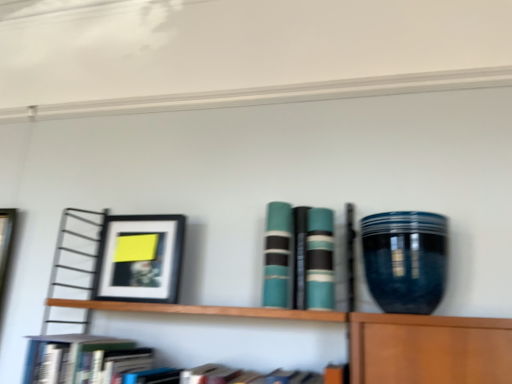
The height and width of the screenshot is (384, 512). I want to click on teal matte book at center, the 4th book positioned from the left, so click(320, 260).

At what (x,y) coordinates should I click in order to perform the action: click on glossy ceramic vase at right. Please return your answer as a coordinate pair (x, y). Looking at the image, I should click on (405, 260).

Image resolution: width=512 pixels, height=384 pixels. What do you see at coordinates (405, 260) in the screenshot? I see `glossy ceramic vase at right` at bounding box center [405, 260].

Image resolution: width=512 pixels, height=384 pixels. What do you see at coordinates (298, 257) in the screenshot?
I see `teal matte book at center, the 2th book in the right-to-left sequence` at bounding box center [298, 257].

In the scene shown: Measure the distance between point (298, 280) and camera.

Point (298, 280) is 1.09 meters away from camera.

Image resolution: width=512 pixels, height=384 pixels. What do you see at coordinates (277, 254) in the screenshot? I see `teal matte book at center, the second book in the left-to-right sequence` at bounding box center [277, 254].

The image size is (512, 384). Find the location of `teal matte book at center, the 4th book positioned from the left`. teal matte book at center, the 4th book positioned from the left is located at coordinates (320, 260).

Between point (223, 381) and point (441, 238), which one is positioned in front?

The point (441, 238) is closer.

Who is bigger, hardcover book at lower left, the 1th book viewed from the left, or glossy ceramic vase at right?

With larger size is hardcover book at lower left, the 1th book viewed from the left.

Between hardcover book at lower left, the 1th book viewed from the left, and glossy ceramic vase at right, which one has more height?

glossy ceramic vase at right.

From the image's perspective, which object appears higher, glossy ceramic vase at right or teal matte book at center, the third book positioned from the left?

glossy ceramic vase at right appears higher in the image.

Locate an element on the screen. Image resolution: width=512 pixels, height=384 pixels. vase on the right of teal matte book at center, the third book positioned from the left is located at coordinates coord(405,260).

Is glossy ceramic vase at right with teal matte book at center, the third book positioned from the left?

They are not placed beside each other.

Measure the distance from glossy ceramic vase at right to teal matte book at center, the 2th book in the right-to-left sequence.

glossy ceramic vase at right and teal matte book at center, the 2th book in the right-to-left sequence, are 22.50 centimeters apart.

There is a matte black picture frame at left. Where is `the 1st book above it (from a real-world perspective)`? the 1st book above it (from a real-world perspective) is located at coordinates (320, 260).

Can you confirm if teal matte book at center, the 4th book positioned from the left, is shorter than matte black picture frame at left?

Correct, teal matte book at center, the 4th book positioned from the left, is not as tall as matte black picture frame at left.

Does glossy ceramic vase at right appear on the right side of hardcover book at lower left, the 1th book viewed from the left?

Yes, glossy ceramic vase at right is to the right of hardcover book at lower left, the 1th book viewed from the left.

Could you tell me if glossy ceramic vase at right is turned towards hardcover book at lower left, the 1th book viewed from the left?

No, glossy ceramic vase at right is not turned towards hardcover book at lower left, the 1th book viewed from the left.

Looking at the image, does glossy ceramic vase at right seem bigger or smaller compared to hardcover book at lower left, the 1th book viewed from the left?

In the image, glossy ceramic vase at right appears to be smaller than hardcover book at lower left, the 1th book viewed from the left.

Between glossy ceramic vase at right and hardcover book at lower left, placed as the fourth book when sorted from right to left, which one is positioned in front?

hardcover book at lower left, placed as the fourth book when sorted from right to left, is closer to the camera.

Based on the photo, does teal matte book at center, the 4th book positioned from the left, have a lesser width compared to teal matte book at center, the third book positioned from the left?

Correct, the width of teal matte book at center, the 4th book positioned from the left, is less than that of teal matte book at center, the third book positioned from the left.

Is there a large distance between teal matte book at center, which ranks as the first book in right-to-left order, and teal matte book at center, the 2th book in the right-to-left sequence?

That's not correct — teal matte book at center, which ranks as the first book in right-to-left order, is a little close to teal matte book at center, the 2th book in the right-to-left sequence.

Considering the positions of point (319, 208) and point (294, 269), is point (319, 208) closer or farther from the camera than point (294, 269)?

Point (319, 208) appears to be farther away from the viewer than point (294, 269).

Would you say teal matte book at center, which ranks as the first book in right-to-left order, is outside teal matte book at center, the 2th book in the right-to-left sequence?

Yes, teal matte book at center, which ranks as the first book in right-to-left order, is outside of teal matte book at center, the 2th book in the right-to-left sequence.

Can you confirm if glossy ceramic vase at right is bigger than matte black picture frame at left?

Correct, glossy ceramic vase at right is larger in size than matte black picture frame at left.

Considering the positions of point (425, 287) and point (134, 221), is point (425, 287) closer or farther from the camera than point (134, 221)?

Clearly, point (425, 287) is closer to the camera than point (134, 221).

From their relative heights in the image, would you say glossy ceramic vase at right is taller or shorter than matte black picture frame at left?

In the image, glossy ceramic vase at right appears to be shorter than matte black picture frame at left.

From the image's perspective, is teal matte book at center, the 4th book positioned from the left, below teal matte book at center, the second book in the left-to-right sequence?

Yes.

Which is in front, point (321, 292) or point (265, 243)?

Positioned in front is point (321, 292).

Is teal matte book at center, which ranks as the first book in right-to-left order, looking in the opposite direction of teal matte book at center, the third book from the right?

No, teal matte book at center, which ranks as the first book in right-to-left order, is not facing the opposite direction of teal matte book at center, the third book from the right.

Between teal matte book at center, which ranks as the first book in right-to-left order, and teal matte book at center, the third book from the right, which one appears on the left side from the viewer's perspective?

teal matte book at center, the third book from the right, is more to the left.

The height and width of the screenshot is (384, 512). Identify the location of book that is the 4th object directly below the glossy ceramic vase at right (from a real-world perspective). (83, 359).

Locate an element on the screen. The image size is (512, 384). the 3rd book positioned below the glossy ceramic vase at right (from the image's perspective) is located at coordinates (298, 257).

From the image, which object appears to be farther from teal matte book at center, the 2th book in the right-to-left sequence, teal matte book at center, the second book in the left-to-right sequence, or matte black picture frame at left?

Among the two, matte black picture frame at left is located further to teal matte book at center, the 2th book in the right-to-left sequence.

From the image, which object appears to be nearer to teal matte book at center, the second book in the left-to-right sequence, teal matte book at center, the 4th book positioned from the left, or hardcover book at lower left, the 1th book viewed from the left?

The object closer to teal matte book at center, the second book in the left-to-right sequence, is teal matte book at center, the 4th book positioned from the left.

Based on their spatial positions, is glossy ceramic vase at right or hardcover book at lower left, placed as the fourth book when sorted from right to left, closer to teal matte book at center, the 2th book in the right-to-left sequence?

Based on the image, glossy ceramic vase at right appears to be nearer to teal matte book at center, the 2th book in the right-to-left sequence.

Considering their positions, is glossy ceramic vase at right positioned closer to teal matte book at center, the third book from the right, than matte black picture frame at left?

glossy ceramic vase at right lies closer to teal matte book at center, the third book from the right, than the other object.

When comparing their distances from teal matte book at center, the 4th book positioned from the left, does teal matte book at center, the third book from the right, or matte black picture frame at left seem further?

matte black picture frame at left.

Based on their spatial positions, is teal matte book at center, the third book positioned from the left, or teal matte book at center, which ranks as the first book in right-to-left order, closer to hardcover book at lower left, placed as the fourth book when sorted from right to left?

teal matte book at center, the third book positioned from the left, is positioned closer to the anchor hardcover book at lower left, placed as the fourth book when sorted from right to left.

Considering their positions, is matte black picture frame at left positioned closer to teal matte book at center, the 4th book positioned from the left, than teal matte book at center, the third book from the right?

teal matte book at center, the third book from the right.

Based on their spatial positions, is matte black picture frame at left or teal matte book at center, the third book positioned from the left, further from teal matte book at center, the second book in the left-to-right sequence?

Based on the image, matte black picture frame at left appears to be further to teal matte book at center, the second book in the left-to-right sequence.

Find the location of a particular element. This screenshot has width=512, height=384. book located between teal matte book at center, the 2th book in the right-to-left sequence, and glossy ceramic vase at right in the left-right direction is located at coordinates (320, 260).

This screenshot has width=512, height=384. Find the location of `book located between hardcover book at lower left, the 1th book viewed from the left, and teal matte book at center, the third book positioned from the left, in the left-right direction`. book located between hardcover book at lower left, the 1th book viewed from the left, and teal matte book at center, the third book positioned from the left, in the left-right direction is located at coordinates (277, 254).

Find the location of a particular element. The width and height of the screenshot is (512, 384). book between matte black picture frame at left and teal matte book at center, the third book from the right, in the horizontal direction is located at coordinates (83, 359).

The height and width of the screenshot is (384, 512). In order to click on book located between teal matte book at center, the second book in the left-to-right sequence, and teal matte book at center, which ranks as the first book in right-to-left order, in the left-right direction in this screenshot , I will do `click(298, 257)`.